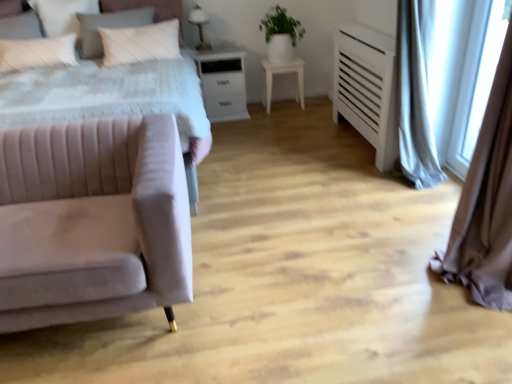
Where is `vacant region to the right of velvet pink couch at left`? vacant region to the right of velvet pink couch at left is located at coordinates (274, 273).